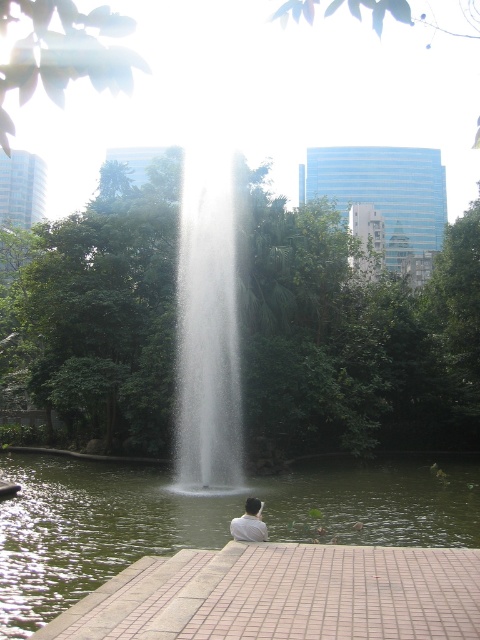
Between green liquid water at center and white matte shirt at lower center, which one has less height?

white matte shirt at lower center is shorter.

Does point (216, 528) come farther from viewer compared to point (250, 506)?

Yes, it is.

Is point (79, 483) closer to camera compared to point (255, 531)?

No, (79, 483) is further to viewer.

This screenshot has height=640, width=480. I want to click on green liquid water at center, so click(x=86, y=531).